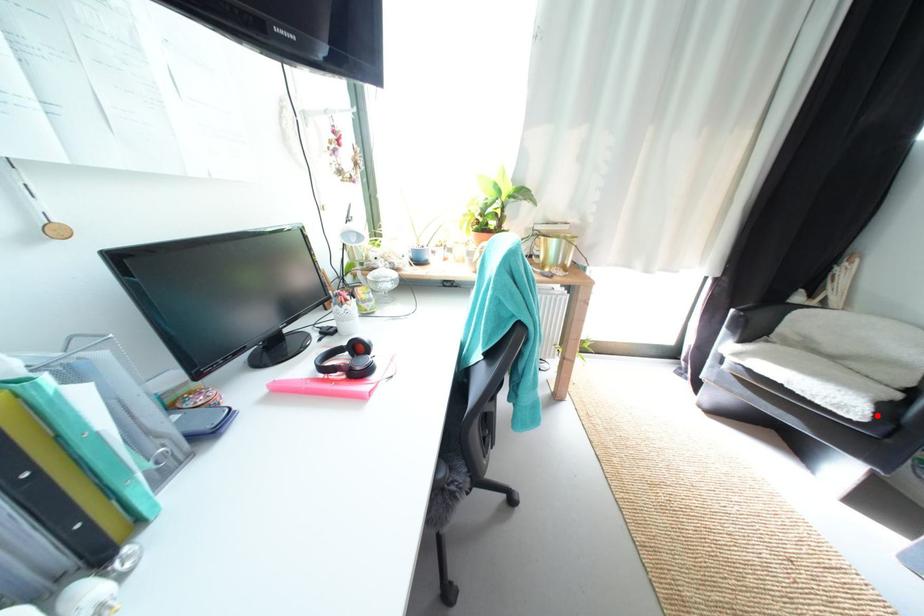
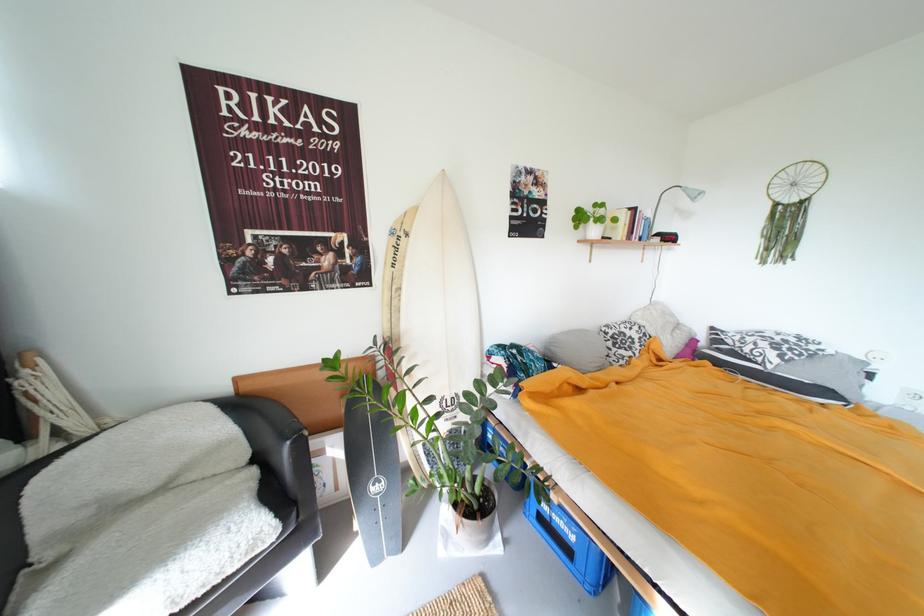
Question: I am providing you with two images of the same scene from different viewpoints. Given a red point in image1, look at the same physical point in image2. Is it:

Choices:
 (A) Closer to the viewpoint
 (B) Farther from the viewpoint

Answer: (A)